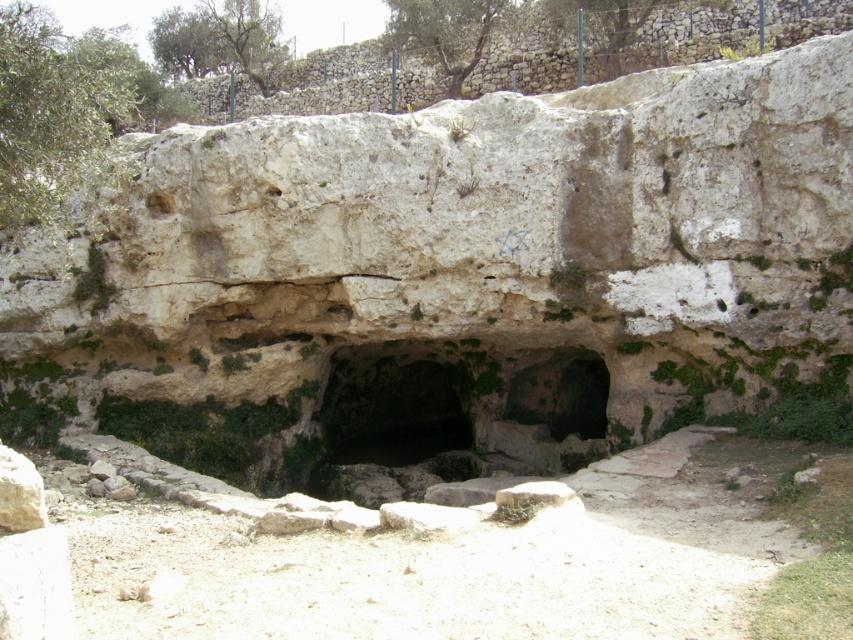
Question: Is green mossy rock at center below smooth stone hole at upper left?

Choices:
 (A) no
 (B) yes

Answer: (B)

Question: Which point appears farthest from the camera in this image?

Choices:
 (A) (160, 195)
 (B) (357, 448)

Answer: (B)

Question: Can you confirm if green mossy rock at center is bigger than smooth stone hole at upper left?

Choices:
 (A) yes
 (B) no

Answer: (B)

Question: Can you confirm if green mossy rock at center is positioned below smooth stone hole at upper left?

Choices:
 (A) no
 (B) yes

Answer: (B)

Question: Which object appears closest to the camera in this image?

Choices:
 (A) smooth stone hole at upper left
 (B) green mossy rock at center

Answer: (A)